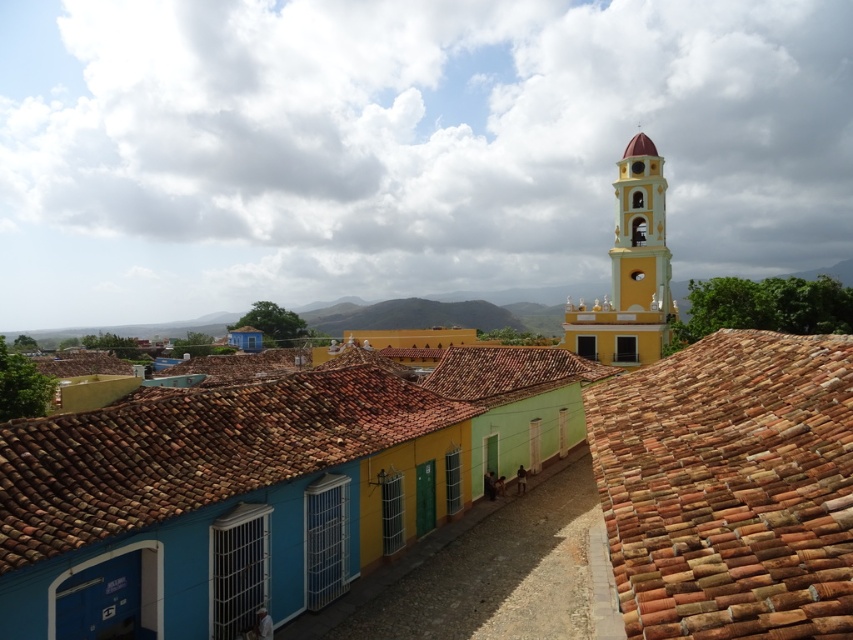
Is yellow matte tower at upper right smaller than yellow matte bell tower at upper right?

Incorrect, yellow matte tower at upper right is not smaller in size than yellow matte bell tower at upper right.

Is yellow matte tower at upper right to the left of yellow matte bell tower at upper right from the viewer's perspective?

Indeed, yellow matte tower at upper right is positioned on the left side of yellow matte bell tower at upper right.

You are a GUI agent. You are given a task and a screenshot of the screen. Output one action in this format:
    pyautogui.click(x=<x>, y=<y>)
    Task: Click on the yellow matte tower at upper right
    Image resolution: width=853 pixels, height=640 pixels.
    Given the screenshot: What is the action you would take?
    pyautogui.click(x=630, y=269)

Locate an element on the screen. This screenshot has height=640, width=853. yellow matte tower at upper right is located at coordinates (630, 269).

Does terracotta tiles at right appear on the left side of yellow matte bell tower at upper right?

Yes, terracotta tiles at right is to the left of yellow matte bell tower at upper right.

You are a GUI agent. You are given a task and a screenshot of the screen. Output one action in this format:
    pyautogui.click(x=<x>, y=<y>)
    Task: Click on the terracotta tiles at right
    This screenshot has width=853, height=640.
    Given the screenshot: What is the action you would take?
    pyautogui.click(x=729, y=486)

Is yellow matte church at upper center to the right of yellow matte tower at upper right from the viewer's perspective?

In fact, yellow matte church at upper center is to the left of yellow matte tower at upper right.

What do you see at coordinates (258, 490) in the screenshot?
I see `yellow matte church at upper center` at bounding box center [258, 490].

Which is in front, point (91, 577) or point (657, 342)?

Point (91, 577) is more forward.

Where is `yellow matte church at upper center`? The image size is (853, 640). yellow matte church at upper center is located at coordinates (258, 490).